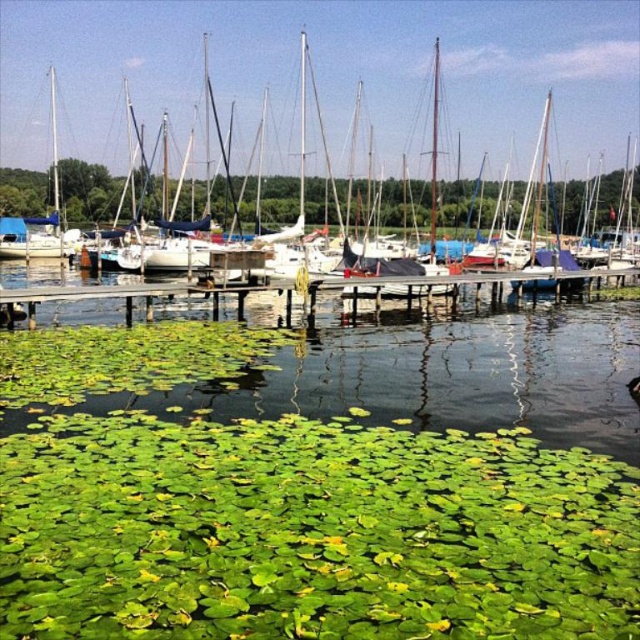
Question: Is white matte sailboat at center positioned before wooden dock at center?

Choices:
 (A) no
 (B) yes

Answer: (A)

Question: Does white matte sailboat at center come in front of wooden dock at center?

Choices:
 (A) no
 (B) yes

Answer: (A)

Question: Which point is closer to the camera?

Choices:
 (A) wooden dock at center
 (B) white matte sailboat at center

Answer: (A)

Question: Where is white matte sailboat at center located in relation to wooden dock at center in the image?

Choices:
 (A) below
 (B) above

Answer: (B)

Question: Which of the following is the farthest from the observer?

Choices:
 (A) wooden dock at center
 (B) white matte sailboat at center

Answer: (B)

Question: Which of the following is the closest to the observer?

Choices:
 (A) (182, 253)
 (B) (323, 280)

Answer: (B)